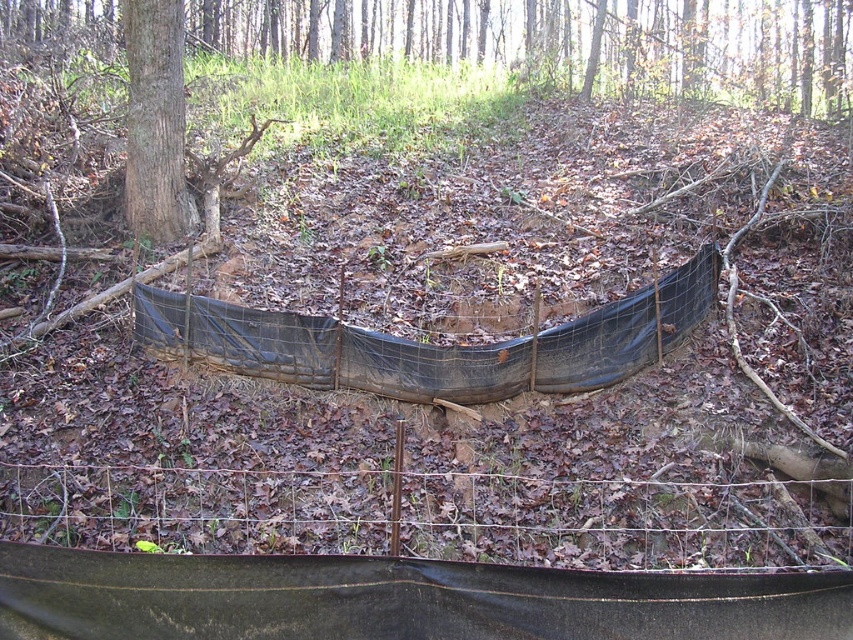
In the scene shown: Is black plastic tarp at center shorter than brown rough bark tree at center-left?

Indeed, black plastic tarp at center has a lesser height compared to brown rough bark tree at center-left.

How much distance is there between black plastic tarp at center and brown rough bark tree at center-left?

A distance of 8.99 feet exists between black plastic tarp at center and brown rough bark tree at center-left.

Describe the element at coordinates (399, 349) in the screenshot. I see `black plastic tarp at center` at that location.

Where is `black plastic tarp at center`? black plastic tarp at center is located at coordinates (399, 349).

Is brown wood tree at upper center wider than black plastic tarp at center?

Yes.

How much distance is there between brown wood tree at upper center and black plastic tarp at center?

brown wood tree at upper center and black plastic tarp at center are 11.58 meters apart.

Between point (793, 3) and point (544, 390), which one is positioned in front?

Point (544, 390) is more forward.

This screenshot has height=640, width=853. I want to click on brown wood tree at upper center, so click(x=567, y=42).

Between point (846, 490) and point (161, 104), which one is positioned behind?

Point (161, 104)

How distant is wire mesh fence at lower center from brown rough bark tree at center-left?

A distance of 13.84 feet exists between wire mesh fence at lower center and brown rough bark tree at center-left.

Between point (93, 522) and point (177, 141), which one is positioned in front?

Point (93, 522)

The width and height of the screenshot is (853, 640). What are the coordinates of `wire mesh fence at lower center` in the screenshot? It's located at (434, 513).